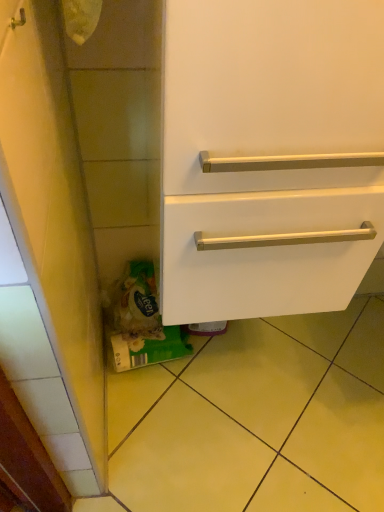
Question: Considering the positions of point (244, 331) and point (233, 167), is point (244, 331) closer or farther from the camera than point (233, 167)?

Choices:
 (A) closer
 (B) farther

Answer: (B)

Question: From the image's perspective, is yellow tile at lower left located above or below white matte drawer at center?

Choices:
 (A) below
 (B) above

Answer: (A)

Question: Considering the relative positions of yellow tile at lower left and white matte drawer at center in the image provided, is yellow tile at lower left to the left or to the right of white matte drawer at center?

Choices:
 (A) left
 (B) right

Answer: (B)

Question: In terms of size, does white matte drawer at center appear bigger or smaller than yellow tile at lower left?

Choices:
 (A) big
 (B) small

Answer: (A)

Question: Is white matte drawer at center situated inside yellow tile at lower left or outside?

Choices:
 (A) outside
 (B) inside

Answer: (A)

Question: In terms of width, does white matte drawer at center look wider or thinner when compared to yellow tile at lower left?

Choices:
 (A) wide
 (B) thin

Answer: (B)

Question: In the image, is white matte drawer at center positioned in front of or behind yellow tile at lower left?

Choices:
 (A) front
 (B) behind

Answer: (A)